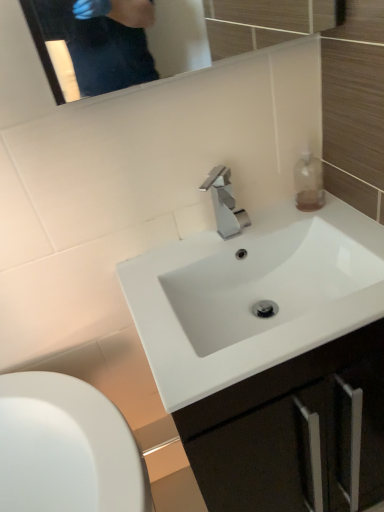
Question: In the image, is white glossy sink at center, which ranks as the 2th sink in bottom-to-top order, positioned in front of or behind white glossy sink at center, the second sink viewed from the top?

Choices:
 (A) behind
 (B) front

Answer: (A)

Question: From the image's perspective, relative to white glossy sink at center, the second sink viewed from the top, is white glossy sink at center, which ranks as the 2th sink in bottom-to-top order, above or below?

Choices:
 (A) above
 (B) below

Answer: (A)

Question: Which object is the farthest from the polished metallic faucet at center?

Choices:
 (A) white glossy sink at center, which ranks as the 2th sink in bottom-to-top order
 (B) white glossy sink at center, the first sink when ordered from bottom to top
 (C) translucent glass bottle at upper right

Answer: (B)

Question: Estimate the real-world distances between objects in this image. Which object is farther from the white glossy sink at center, the second sink viewed from the top?

Choices:
 (A) white glossy sink at center, which ranks as the 2th sink in bottom-to-top order
 (B) polished metallic faucet at center
 (C) translucent glass bottle at upper right

Answer: (C)